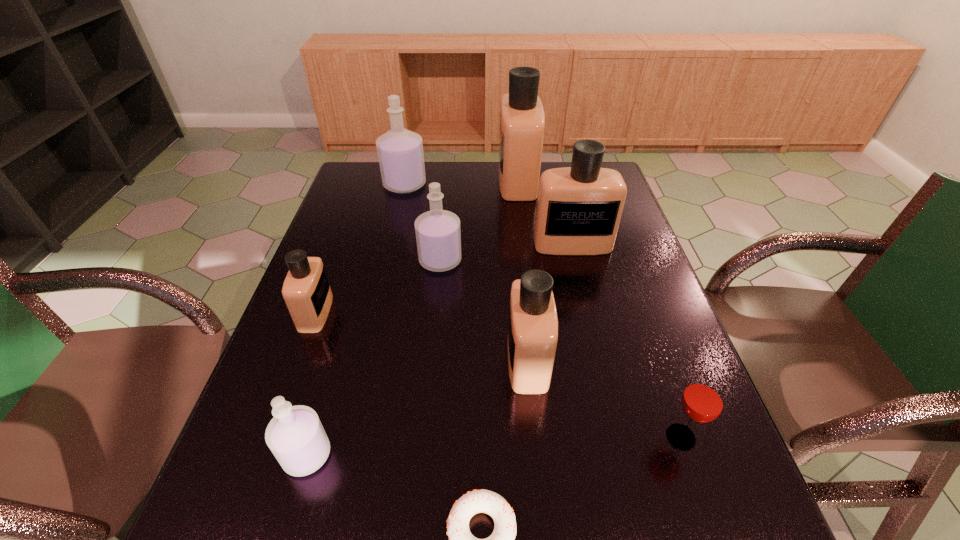
Locate an element on the screen. the leftmost beige perfume is located at coordinates (306, 290).

This screenshot has width=960, height=540. I want to click on red glass, so click(703, 399).

Locate an element on the screen. The image size is (960, 540). blank space located on the front label of the tallest perfume is located at coordinates (425, 180).

Locate an element on the screen. This screenshot has width=960, height=540. free location located on the front label of the tallest perfume is located at coordinates (396, 180).

Find the location of a particular element. Image resolution: width=960 pixels, height=540 pixels. vacant space located on the front label of the tallest perfume is located at coordinates (405, 180).

At what (x,y) coordinates should I click in order to perform the action: click on free location located on the right of the farthest purple perfume. Please return your answer as a coordinate pair (x, y). This screenshot has height=540, width=960. Looking at the image, I should click on (533, 185).

The height and width of the screenshot is (540, 960). Identify the location of free space located 0.240m on the front label of the third nearest beige perfume. (591, 321).

Locate an element on the screen. This screenshot has height=540, width=960. vacant region located 0.350m on the right of the rightmost purple perfume is located at coordinates (589, 260).

Where is `blank space located on the front label of the third biggest beige perfume`? The image size is (960, 540). blank space located on the front label of the third biggest beige perfume is located at coordinates (371, 360).

Find the location of a particular element. This screenshot has height=540, width=960. vacant space located 0.320m on the front label of the third biggest beige perfume is located at coordinates (361, 360).